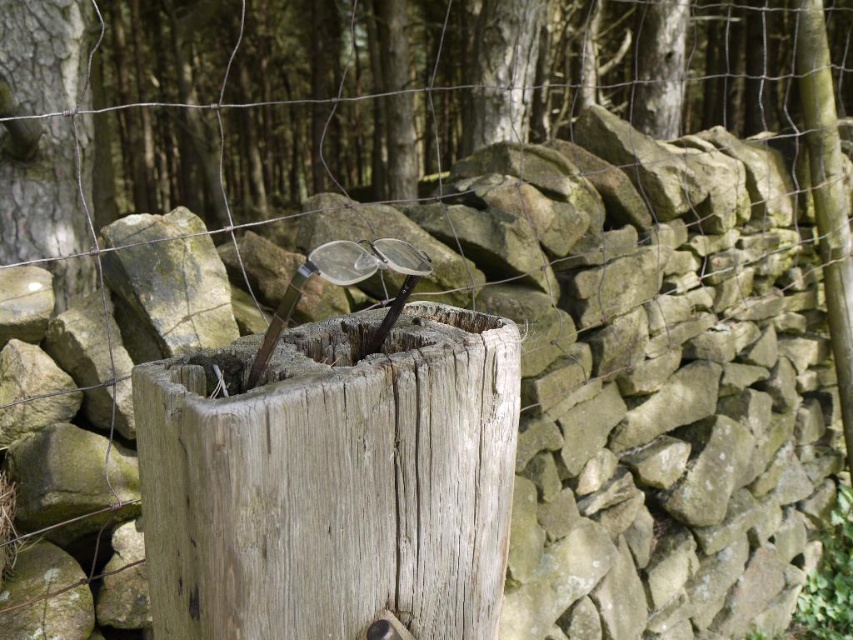
The height and width of the screenshot is (640, 853). What are the coordinates of `weathered wood at center` in the screenshot? It's located at (332, 481).

You are a GUI agent. You are given a task and a screenshot of the screen. Output one action in this format:
    pyautogui.click(x=<x>, y=<y>)
    Task: Click on the weathered wood at center
    
    Given the screenshot: What is the action you would take?
    [x=332, y=481]